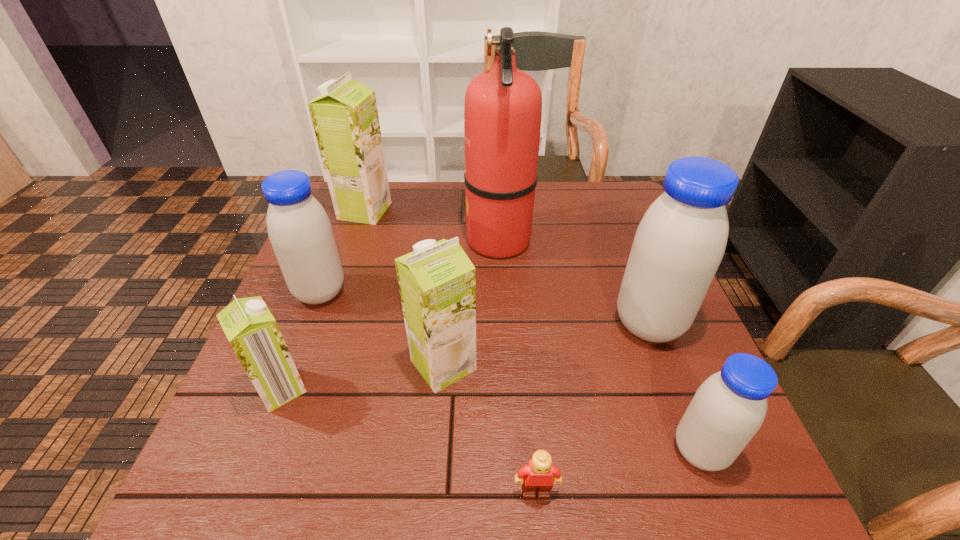
Locate an element on the screen. The image size is (960, 540). free space that satisfies the following two spatial constraints: 1. on the side of the biggest blue soya milk with the nozzle and handle; 2. on the right side of the tallest object is located at coordinates (503, 324).

This screenshot has height=540, width=960. I want to click on vacant area in the image that satisfies the following two spatial constraints: 1. on the back side of the biggest green soya milk; 2. on the right side of the leftmost blue soya milk, so click(351, 211).

Locate an element on the screen. free space that satisfies the following two spatial constraints: 1. on the side of the tallest object with the nozzle and handle; 2. on the back side of the smallest blue soya milk is located at coordinates (510, 451).